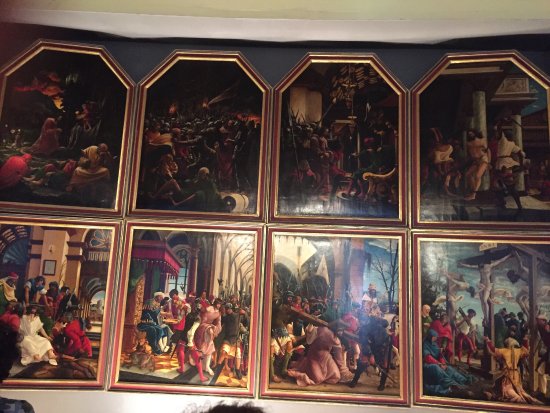
Where is `picture`? The image size is (550, 413). picture is located at coordinates (99, 201).